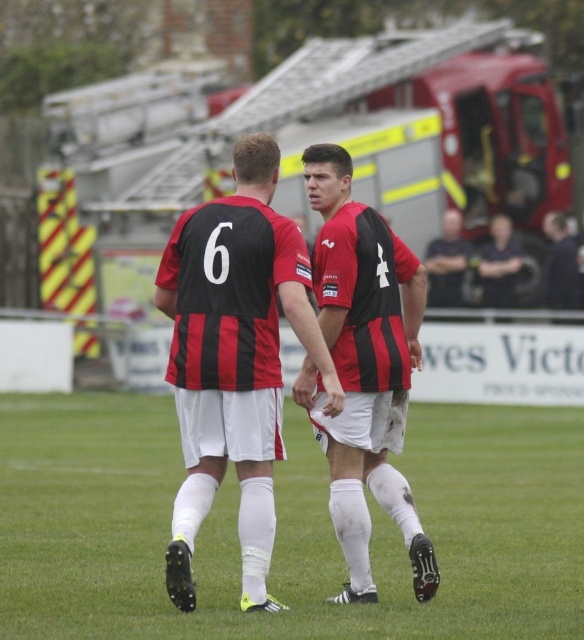
Describe the element at coordinates (286, 525) in the screenshot. This screenshot has width=584, height=640. I see `green grass at center` at that location.

Between green grass at center and dark gray shirt at center, which one is positioned lower?

green grass at center is lower down.

Between point (308, 563) and point (467, 262), which one is positioned in front?

Point (308, 563) is in front.

This screenshot has height=640, width=584. In order to click on green grass at center in this screenshot , I will do `click(286, 525)`.

Does dark gray shirt at center have a lesser width compared to dark blue shirt at right?

No.

Is dark gray shirt at center above dark blue shirt at right?

Indeed, dark gray shirt at center is positioned over dark blue shirt at right.

Locate an element on the screen. Image resolution: width=584 pixels, height=640 pixels. dark gray shirt at center is located at coordinates (446, 262).

Is matte black jersey at center closer to camera compared to matte red and black jersey at center?

Yes, it is in front of matte red and black jersey at center.

Between point (245, 513) and point (321, 435), which one is positioned in front?

Point (245, 513)

Is point (192, 540) positioned before point (373, 230)?

That is True.

Where is `matte black jersey at center`? matte black jersey at center is located at coordinates (234, 358).